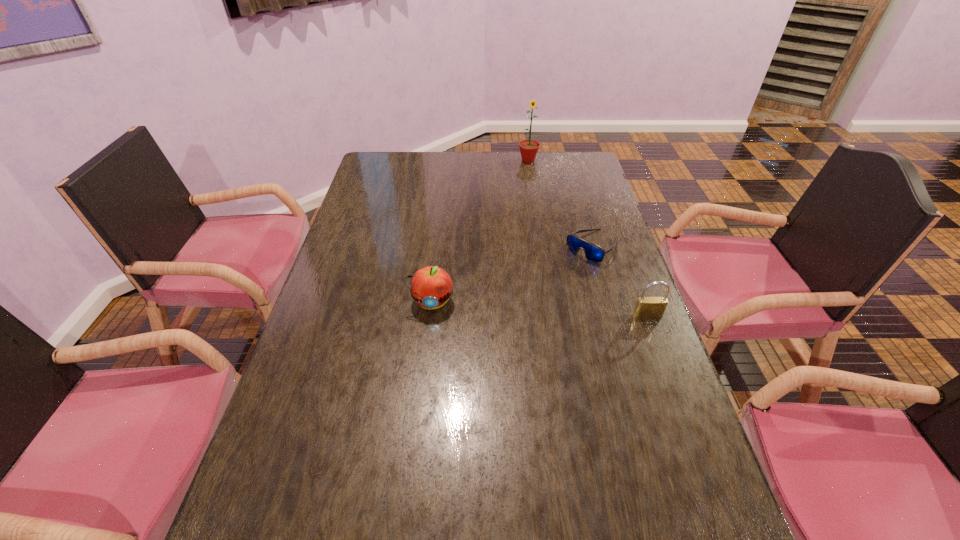
This screenshot has width=960, height=540. In order to click on vacant region located on the face of the tallest object in this screenshot , I will do `click(532, 180)`.

You are a GUI agent. You are given a task and a screenshot of the screen. Output one action in this format:
    pyautogui.click(x=<x>, y=<y>)
    Task: Click on the vacant region located on the front-facing side of the shortest object
    
    Given the screenshot: What is the action you would take?
    pyautogui.click(x=527, y=307)

Image resolution: width=960 pixels, height=540 pixels. In order to click on blank space located 0.140m on the front-facing side of the shortest object in this screenshot , I will do `click(552, 285)`.

Where is `vacant region located 0.090m on the front-facing side of the shortest object`? The height and width of the screenshot is (540, 960). vacant region located 0.090m on the front-facing side of the shortest object is located at coordinates (562, 275).

Locate an element on the screen. The height and width of the screenshot is (540, 960). object that is at the far edge is located at coordinates (528, 148).

Where is `padlock that is at the right edge`? padlock that is at the right edge is located at coordinates (646, 307).

You are a GUI agent. You are given a task and a screenshot of the screen. Output one action in this format:
    pyautogui.click(x=<x>, y=<y>)
    Task: Click on the sunglasses that is positioned at the right edge
    The width and height of the screenshot is (960, 540).
    Given the screenshot: What is the action you would take?
    pyautogui.click(x=594, y=253)

Identify the location of vacant area at the far edge. This screenshot has height=540, width=960. (482, 166).

Image resolution: width=960 pixels, height=540 pixels. Identify the location of vacant space at the near edge. (416, 519).

Locate an element on the screen. The image size is (960, 540). free spot at the right edge of the desktop is located at coordinates (621, 347).